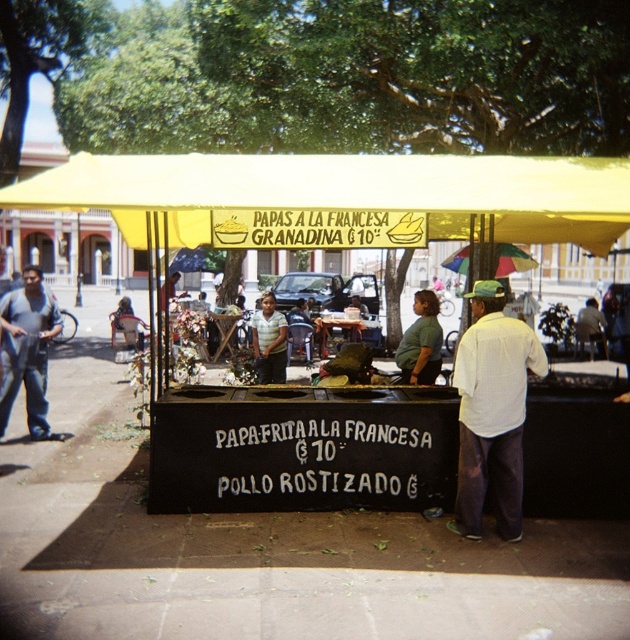
Can you confirm if yellow fabric canopy at center is wider than striped shirt at center?

Yes, yellow fabric canopy at center is wider than striped shirt at center.

Measure the distance from yellow fabric canopy at center to striped shirt at center.

11.24 feet

Locate an element on the screen. This screenshot has height=640, width=630. yellow fabric canopy at center is located at coordinates (345, 192).

Looking at this image, who is more distant from viewer, (146,189) or (481,390)?

The point (481,390) is more distant.

Does yellow fabric canopy at center have a greater height compared to white textured shirt at center?

Yes, yellow fabric canopy at center is taller than white textured shirt at center.

Who is more distant from viewer, (508,189) or (481,400)?

Positioned behind is point (481,400).

Locate an element on the screen. The height and width of the screenshot is (640, 630). yellow fabric canopy at center is located at coordinates (345, 192).

Consider the image. Who is more forward, (x=500, y=365) or (x=263, y=381)?

Point (x=500, y=365) is in front.

Where is `white textured shirt at center`? The width and height of the screenshot is (630, 640). white textured shirt at center is located at coordinates (493, 412).